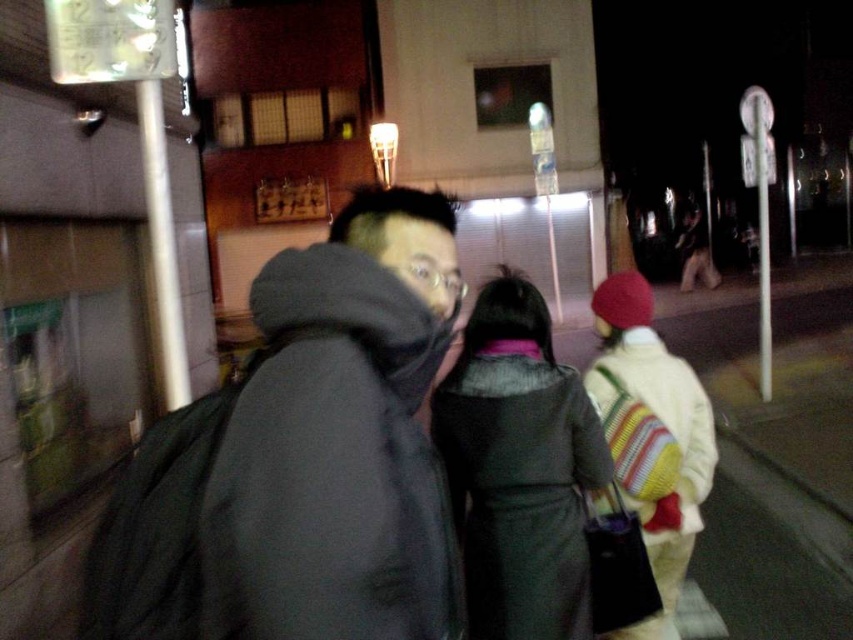
Question: Which object is farther from the camera taking this photo?

Choices:
 (A) dark gray wool coat at center
 (B) dark gray hooded jacket at center

Answer: (A)

Question: Does dark gray hooded jacket at center appear over dark gray wool coat at center?

Choices:
 (A) yes
 (B) no

Answer: (A)

Question: Is dark gray hooded jacket at center closer to the viewer compared to dark gray wool coat at center?

Choices:
 (A) yes
 (B) no

Answer: (A)

Question: Which point is closer to the camera?

Choices:
 (A) dark gray wool coat at center
 (B) dark gray hooded jacket at center

Answer: (B)

Question: Does dark gray hooded jacket at center have a larger size compared to dark gray wool coat at center?

Choices:
 (A) no
 (B) yes

Answer: (A)